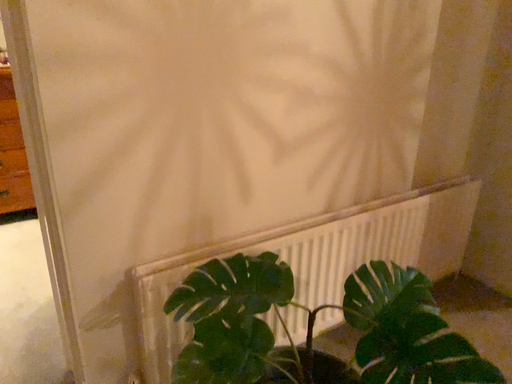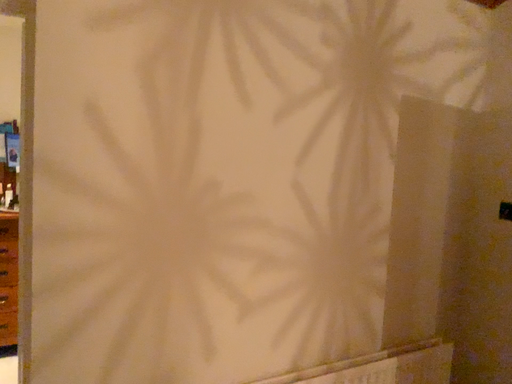
Question: Which way did the camera rotate in the video?

Choices:
 (A) rotated upward
 (B) rotated downward

Answer: (A)